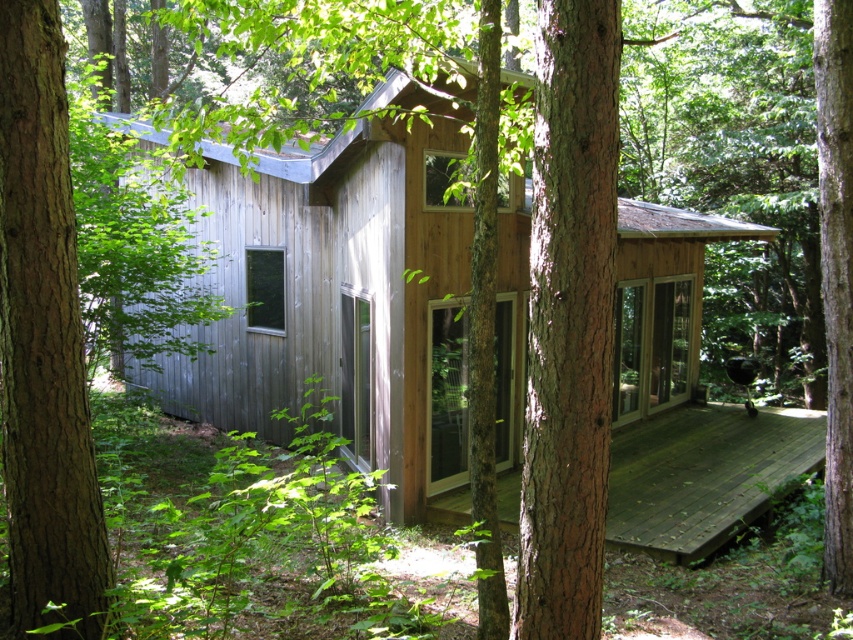
Question: Among these points, which one is farthest from the camera?

Choices:
 (A) click(x=567, y=598)
 (B) click(x=846, y=570)
 (C) click(x=712, y=444)
 (D) click(x=39, y=600)

Answer: (C)

Question: Which point is closer to the camera?

Choices:
 (A) (535, 476)
 (B) (846, 500)

Answer: (A)

Question: Does brown rough bark tree at center appear on the right side of brown rough tree trunk at center?

Choices:
 (A) yes
 (B) no

Answer: (B)

Question: Is brown rough bark tree at center smaller than brown rough tree trunk at left?

Choices:
 (A) no
 (B) yes

Answer: (A)

Question: Observing the image, what is the correct spatial positioning of brown rough bark tree at center in reference to dark brown wooden deck at lower right?

Choices:
 (A) left
 (B) right

Answer: (A)

Question: Which point is closer to the camera?

Choices:
 (A) (845, 163)
 (B) (614, 168)
 (C) (33, 88)

Answer: (B)